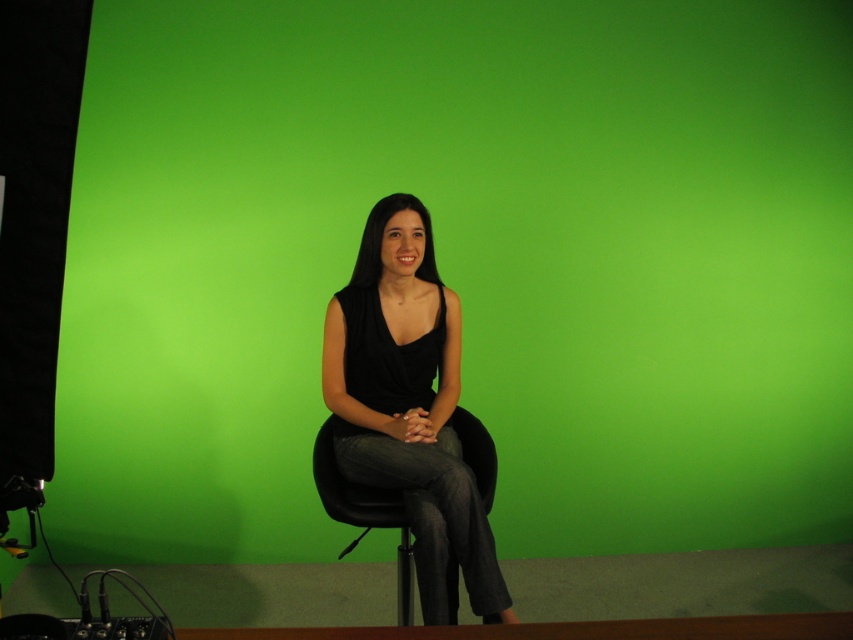
Who is taller, black matte/black fabric at center or black plastic chair at center?

black matte/black fabric at center is taller.

Which is in front, point (372, 296) or point (473, 417)?

Point (372, 296) is more forward.

Where is `black matte/black fabric at center`? The image size is (853, 640). black matte/black fabric at center is located at coordinates (409, 404).